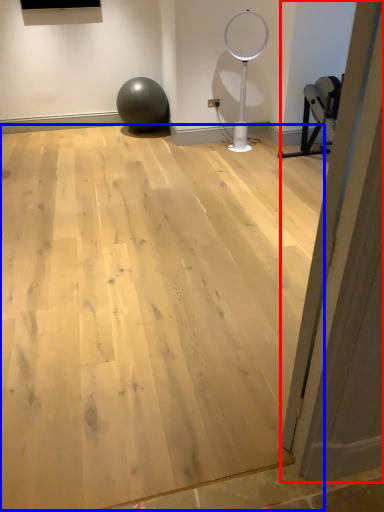
Question: Which object is further to the camera taking this photo, door (highlighted by a red box) or plywood (highlighted by a blue box)?

Choices:
 (A) door
 (B) plywood

Answer: (B)